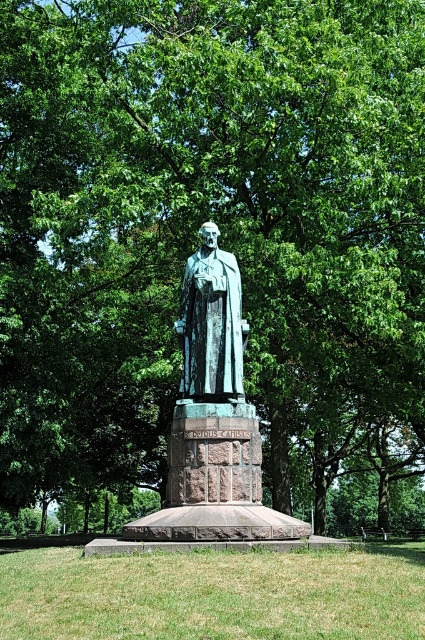
Question: Is the position of green patina statue at center more distant than that of bronze statue at center?

Choices:
 (A) no
 (B) yes

Answer: (A)

Question: Which of the following is the farthest from the observer?

Choices:
 (A) green grass at center
 (B) bronze statue at center
 (C) green patina statue at center

Answer: (B)

Question: From the image, what is the correct spatial relationship of green grass at center in relation to green patina statue at center?

Choices:
 (A) below
 (B) above

Answer: (A)

Question: Which of the following is the farthest from the observer?

Choices:
 (A) bronze statue at center
 (B) green grass at center

Answer: (A)

Question: Estimate the real-world distances between objects in this image. Which object is closer to the green grass at center?

Choices:
 (A) green patina statue at center
 (B) bronze statue at center

Answer: (A)

Question: Is green grass at center bigger than green patina statue at center?

Choices:
 (A) no
 (B) yes

Answer: (B)